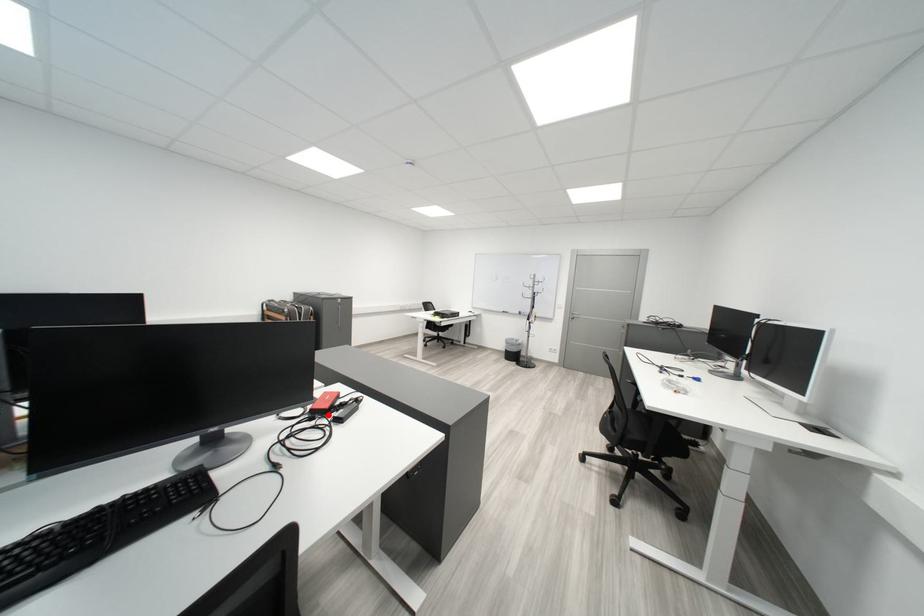
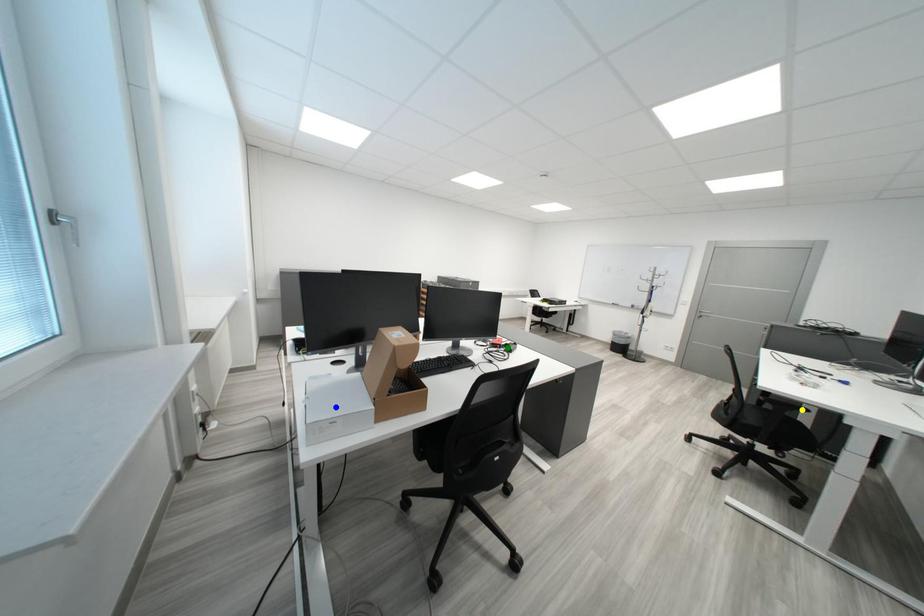
Question: I am providing you with two images of the same scene from different viewpoints. A red point is marked on the first image. You are given multiple points on the second image. Can you choose the point in image 2 that corresponds to the point in image 1?

Choices:
 (A) blue point
 (B) yellow point
 (C) green point

Answer: (C)